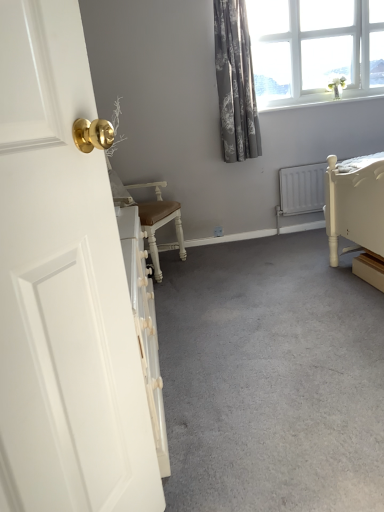
Question: Considering the relative positions of white glass window at upper right and gray carpet at center in the image provided, is white glass window at upper right behind gray carpet at center?

Choices:
 (A) no
 (B) yes

Answer: (B)

Question: Is white glass window at upper right wider than gray carpet at center?

Choices:
 (A) yes
 (B) no

Answer: (B)

Question: Is white glass window at upper right surrounding gray carpet at center?

Choices:
 (A) no
 (B) yes

Answer: (A)

Question: Is the surface of white glass window at upper right in direct contact with gray carpet at center?

Choices:
 (A) no
 (B) yes

Answer: (A)

Question: Can you confirm if white glass window at upper right is thinner than gray carpet at center?

Choices:
 (A) yes
 (B) no

Answer: (A)

Question: From the image's perspective, is white glossy door at left located above or below gray floral fabric curtain at upper right?

Choices:
 (A) above
 (B) below

Answer: (B)

Question: In terms of size, does white glossy door at left appear bigger or smaller than gray floral fabric curtain at upper right?

Choices:
 (A) big
 (B) small

Answer: (A)

Question: Would you say white glossy door at left is inside or outside gray floral fabric curtain at upper right?

Choices:
 (A) inside
 (B) outside

Answer: (B)

Question: Looking at their shapes, would you say white glossy door at left is wider or thinner than gray floral fabric curtain at upper right?

Choices:
 (A) wide
 (B) thin

Answer: (B)

Question: From a real-world perspective, is gray floral fabric curtain at upper right physically located above or below white glossy door at left?

Choices:
 (A) below
 (B) above

Answer: (B)

Question: From the image's perspective, is gray floral fabric curtain at upper right above or below white glossy door at left?

Choices:
 (A) above
 (B) below

Answer: (A)

Question: In terms of width, does gray floral fabric curtain at upper right look wider or thinner when compared to white glossy door at left?

Choices:
 (A) thin
 (B) wide

Answer: (B)

Question: Do you think gray floral fabric curtain at upper right is within white glossy door at left, or outside of it?

Choices:
 (A) inside
 (B) outside

Answer: (B)

Question: From the image's perspective, is white glossy door at left positioned above or below white glass window at upper right?

Choices:
 (A) above
 (B) below

Answer: (B)

Question: Based on their positions, is white glossy door at left located to the left or right of white glass window at upper right?

Choices:
 (A) left
 (B) right

Answer: (A)